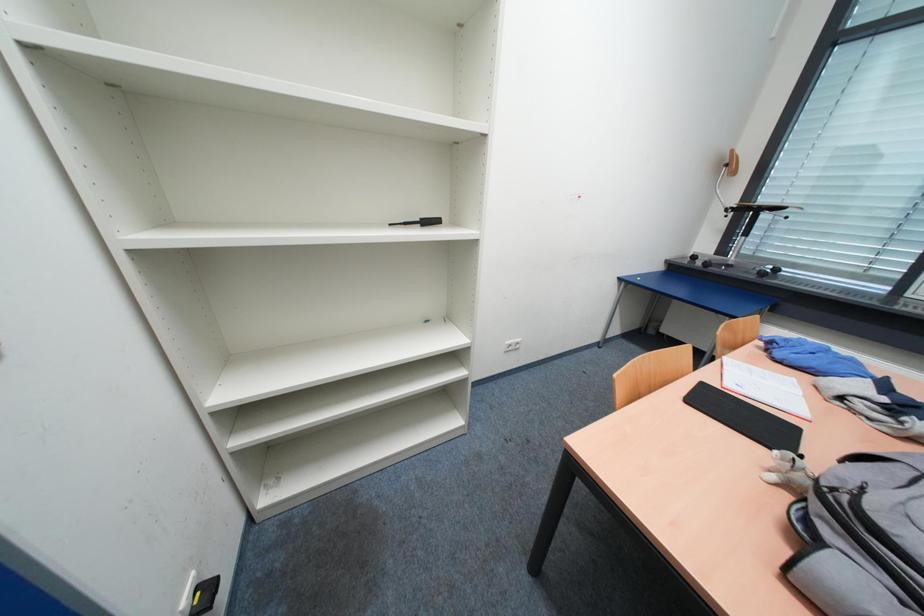
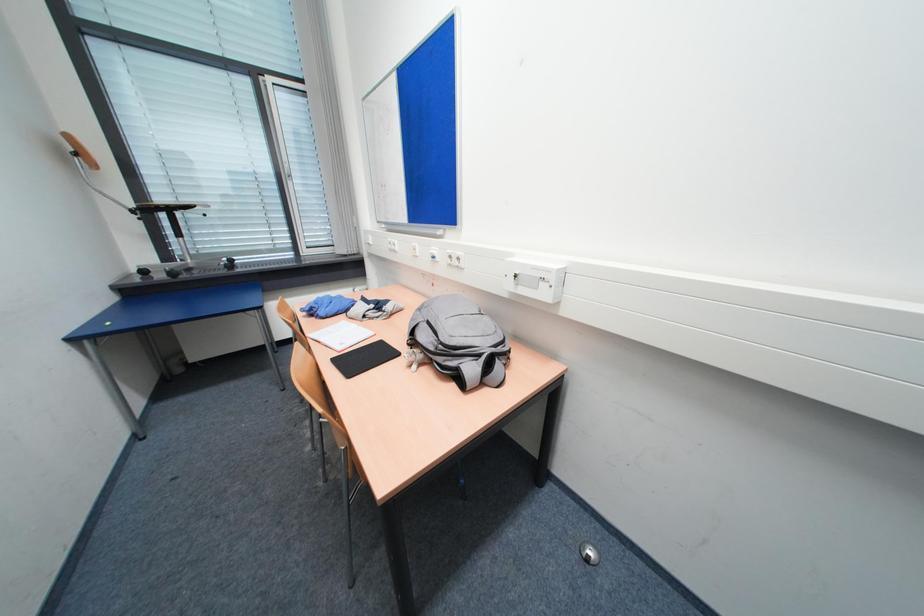
Looking at this image, how did the camera likely rotate?

The rotation direction of the camera is right-down.